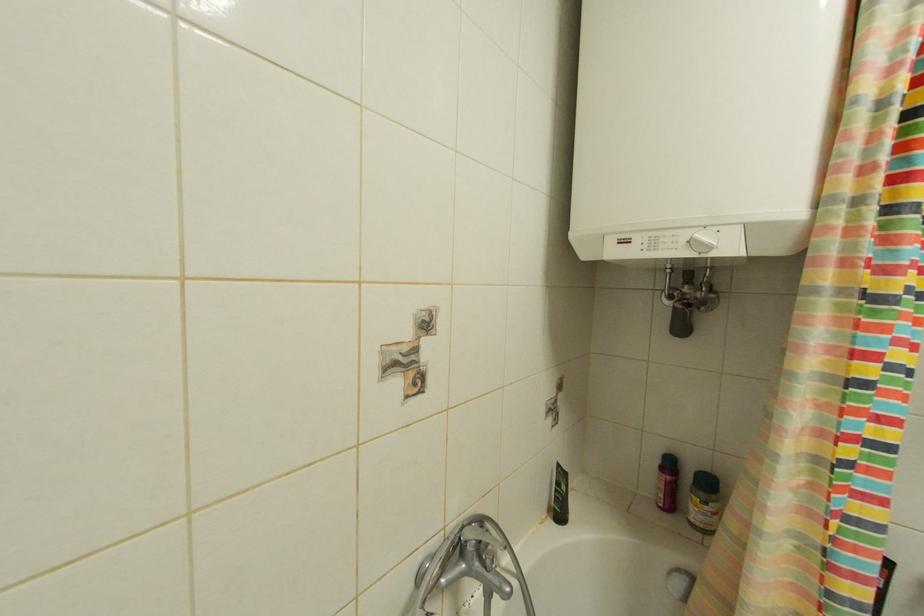
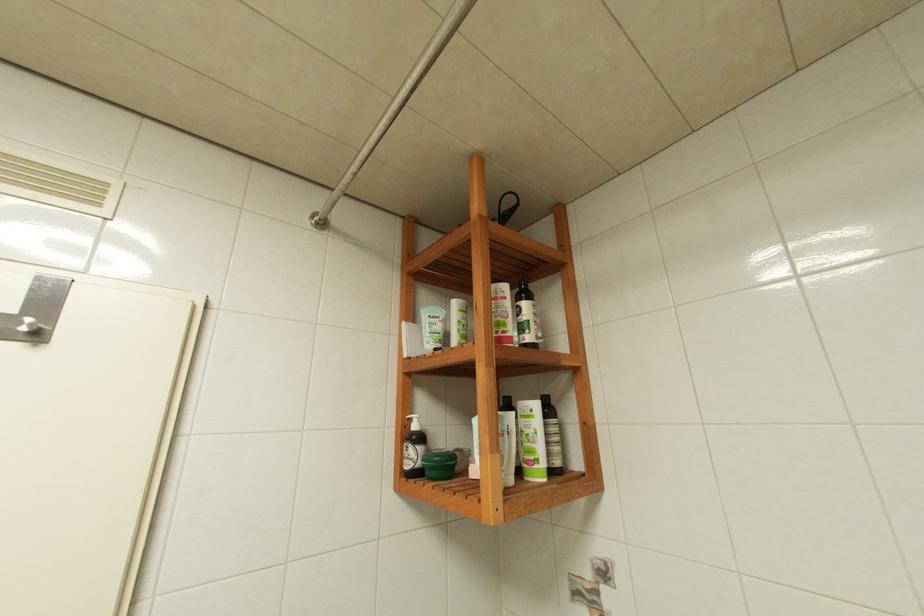
From the picture: First-person continuous shooting, in which direction is the camera rotating?

The camera rotated toward left-up.